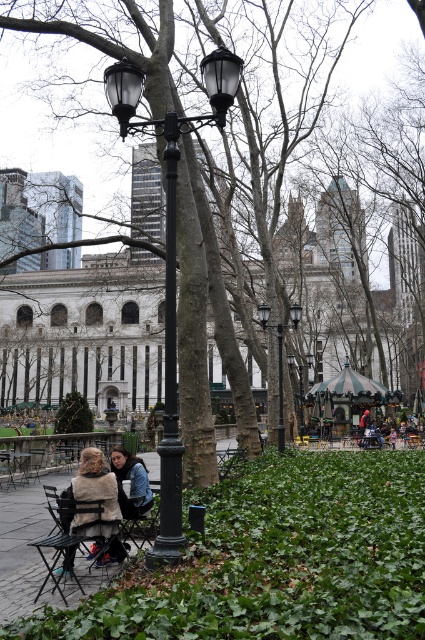
Who is more distant from viewer, (x=164, y=440) or (x=122, y=556)?

Positioned behind is point (x=122, y=556).

Can you confirm if black glass street light at center is taller than matte black jacket at lower left?

Indeed, black glass street light at center has a greater height compared to matte black jacket at lower left.

Does point (175, 460) come closer to viewer compared to point (121, 477)?

Yes, it is.

Where is `black glass street light at center`? The image size is (425, 640). black glass street light at center is located at coordinates (170, 257).

Who is positioned more to the left, black polished metal pole at center or matte black jacket at lower left?

Positioned to the left is matte black jacket at lower left.

What do you see at coordinates (170, 371) in the screenshot? I see `black polished metal pole at center` at bounding box center [170, 371].

The width and height of the screenshot is (425, 640). What do you see at coordinates (170, 371) in the screenshot?
I see `black polished metal pole at center` at bounding box center [170, 371].

You are a GUI agent. You are given a task and a screenshot of the screen. Output one action in this format:
    pyautogui.click(x=<x>, y=<y>)
    Task: Click on the black polished metal pole at center
    The height and width of the screenshot is (640, 425).
    Given the screenshot: What is the action you would take?
    pyautogui.click(x=170, y=371)

Who is lower down, brown textured tree at center or black metal pole at center?

black metal pole at center is lower down.

Where is `brown textured tree at center`? This screenshot has height=640, width=425. brown textured tree at center is located at coordinates (274, 147).

Find the location of a particular element. Image resolution: width=425 pixels, height=640 pixels. brown textured tree at center is located at coordinates (274, 147).